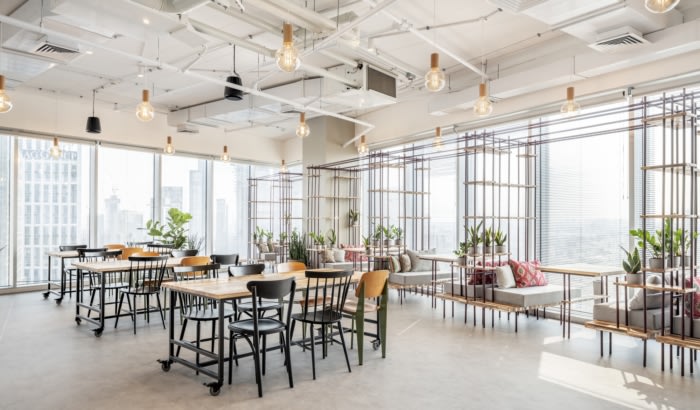
This screenshot has height=410, width=700. Find the location of `cushioned bench seats`. cushioned bench seats is located at coordinates (528, 293), (606, 307), (682, 328), (407, 279), (342, 261).